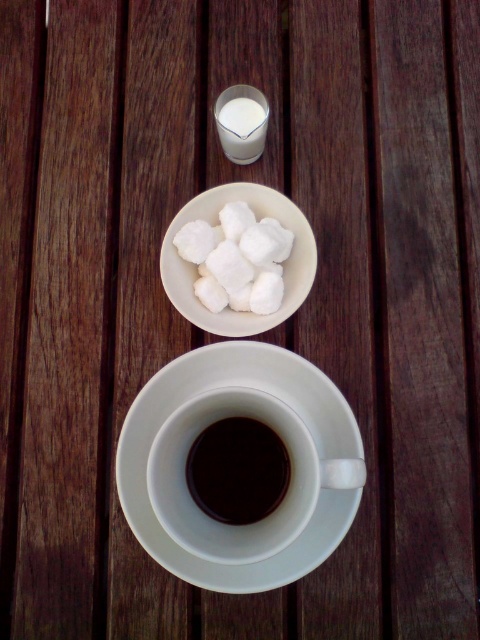
Question: Which object is closer to the camera taking this photo?

Choices:
 (A) white sugar cubes at center
 (B) white ceramic saucer at center
 (C) black matte cup at center

Answer: (B)

Question: Is white ceramic saucer at center below white sugar cubes at center?

Choices:
 (A) yes
 (B) no

Answer: (A)

Question: Which object is positioned closest to the white sugar cubes at center?

Choices:
 (A) white ceramic saucer at center
 (B) black matte cup at center

Answer: (A)

Question: Is white sugar cubes at center to the right of black matte cup at center from the viewer's perspective?

Choices:
 (A) no
 (B) yes

Answer: (A)

Question: In this image, where is white sugar cubes at center located relative to black matte cup at center?

Choices:
 (A) above
 (B) below

Answer: (A)

Question: Based on their relative distances, which object is farther from the black matte cup at center?

Choices:
 (A) white sugar cubes at center
 (B) white ceramic saucer at center

Answer: (A)